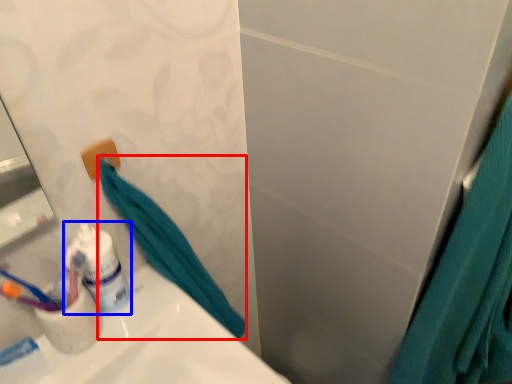
Question: Which point is closer to the camera, bath towel (highlighted by a red box) or toiletry (highlighted by a blue box)?

Choices:
 (A) bath towel
 (B) toiletry

Answer: (A)